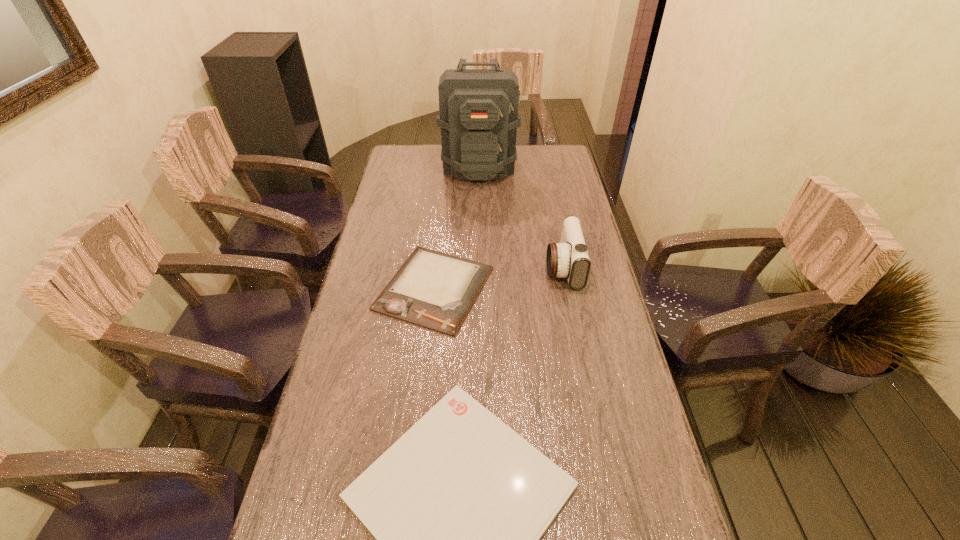
I want to click on backpack, so click(x=478, y=116).

This screenshot has width=960, height=540. I want to click on the farthest object, so click(478, 116).

Identify the location of camcorder. (569, 259).

This screenshot has width=960, height=540. I want to click on the third shortest object, so click(569, 259).

Where is `the farther clipboard`? the farther clipboard is located at coordinates (435, 290).

The height and width of the screenshot is (540, 960). I want to click on vacant area situated 0.190m on the front compartment of the farthest object, so click(x=479, y=216).

Where is `free space located on the surface of the camcorder`? The width and height of the screenshot is (960, 540). free space located on the surface of the camcorder is located at coordinates (455, 267).

Locate an element on the screen. free space located on the surface of the camcorder is located at coordinates (490, 267).

This screenshot has height=540, width=960. In order to click on vacant space located on the surface of the camcorder in this screenshot , I will do point(512,267).

I want to click on blank area located on the front of the farther clipboard, so click(x=422, y=402).